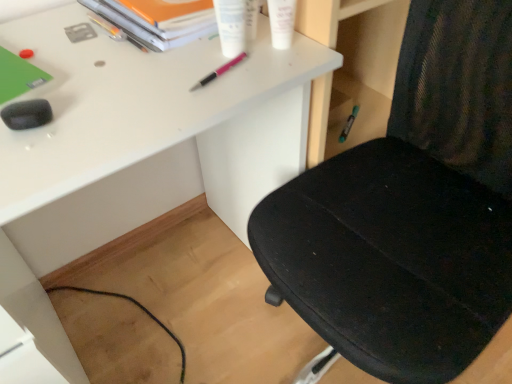
Where is `vacant space to the right of pink metallic pen at upper center, which is the 4th stationery from front to back`? The width and height of the screenshot is (512, 384). vacant space to the right of pink metallic pen at upper center, which is the 4th stationery from front to back is located at coordinates (280, 59).